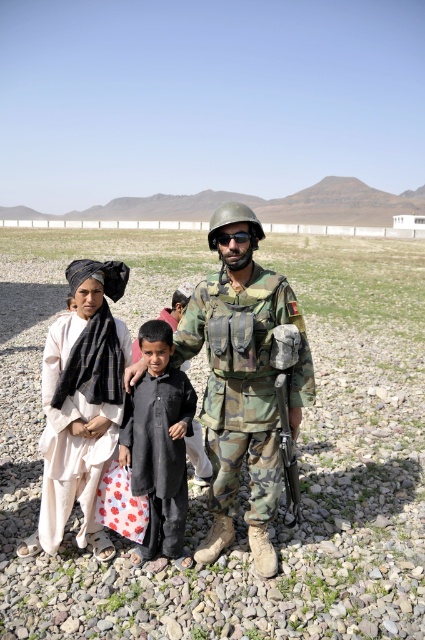
Measure the distance between white cotton dress at left and camera.

They are 11.28 feet apart.

Does white cotton dress at left have a lesser height compared to black matte goggles at center?

Incorrect, white cotton dress at left's height does not fall short of black matte goggles at center's.

Who is more distant from viewer, (45, 392) or (229, 236)?

Positioned behind is point (45, 392).

Image resolution: width=425 pixels, height=640 pixels. I want to click on white cotton dress at left, so click(70, 442).

Is camouflage uniform at center to the left of camouflage fabric uniform at center from the viewer's perspective?

Correct, you'll find camouflage uniform at center to the left of camouflage fabric uniform at center.

Between point (207, 353) and point (260, 356), which one is positioned behind?

The point (207, 353) is behind.

At what (x,y) coordinates should I click in order to perform the action: click on camouflage uniform at center. Please return your answer as a coordinate pair (x, y). This screenshot has width=425, height=640. Looking at the image, I should click on (243, 381).

Does camouflage uniform at center have a lesser height compared to black matte goggles at center?

In fact, camouflage uniform at center may be taller than black matte goggles at center.

Can you confirm if camouflage uniform at center is positioned to the right of black matte goggles at center?

Incorrect, camouflage uniform at center is not on the right side of black matte goggles at center.

The image size is (425, 640). I want to click on camouflage uniform at center, so click(243, 381).

You are a GUI agent. You are given a task and a screenshot of the screen. Output one action in this format:
    pyautogui.click(x=<x>, y=<y>)
    Task: Click on the camouflage uniform at center
    The width and height of the screenshot is (425, 640).
    Given the screenshot: What is the action you would take?
    pyautogui.click(x=243, y=381)